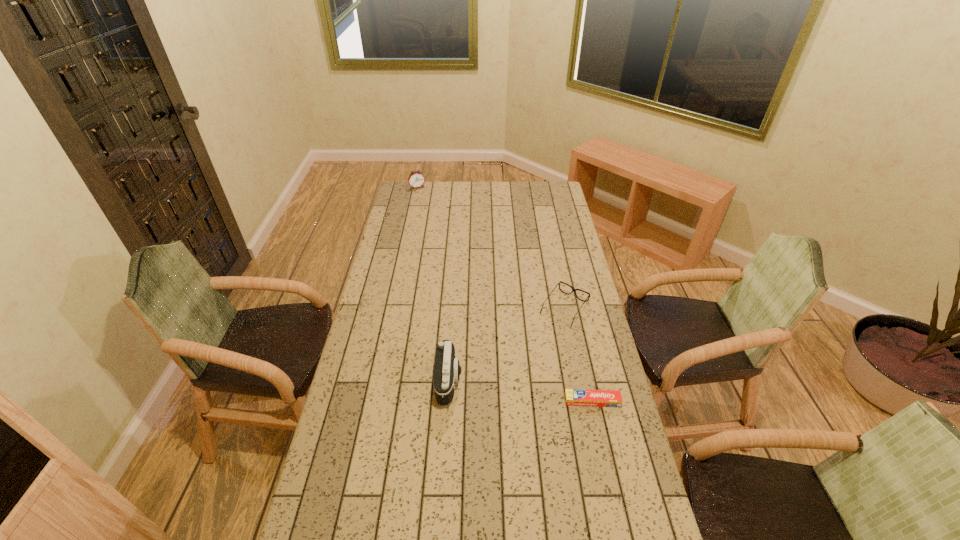
You are a GUI agent. You are given a task and a screenshot of the screen. Output one action in this format:
    pyautogui.click(x=<x>, y=<y>)
    Task: Click on the camera
    Image resolution: width=960 pixels, height=540 pixels.
    Given the screenshot: What is the action you would take?
    pyautogui.click(x=447, y=370)

At what (x,y) coordinates should I click in order to perform the action: click on toothpaste. Please return your answer as a coordinate pair (x, y). The image size is (960, 540). Looking at the image, I should click on pyautogui.click(x=573, y=397).

Where is `the leftmost object`? the leftmost object is located at coordinates (416, 179).

Where is `the second tallest object`? This screenshot has height=540, width=960. the second tallest object is located at coordinates pyautogui.click(x=416, y=179).

You are a GUI agent. You are given a task and a screenshot of the screen. Output one action in this format:
    pyautogui.click(x=<x>, y=<y>)
    Task: Click on the spectacles
    
    Given the screenshot: What is the action you would take?
    pyautogui.click(x=573, y=290)

Image resolution: width=960 pixels, height=540 pixels. What are the coordinates of `the second farthest object` in the screenshot? It's located at (573, 290).

The width and height of the screenshot is (960, 540). I want to click on vacant space located on the front lens of the camera, so click(x=479, y=381).

I want to click on vacant point located on the left of the toothpaste, so click(x=471, y=401).

Find the location of `free space located 0.070m on the clock face of the third shortest object`. free space located 0.070m on the clock face of the third shortest object is located at coordinates (422, 196).

Locate an element on the screen. vacant space located on the clock face of the third shortest object is located at coordinates (433, 217).